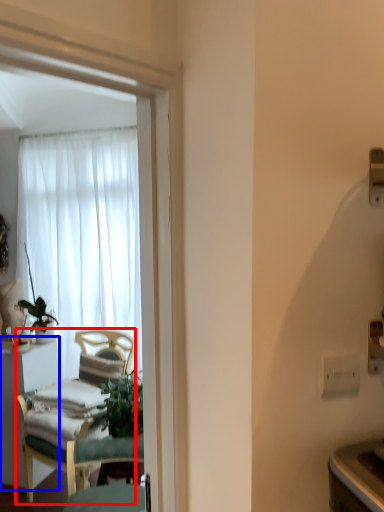
Question: Which object appears farthest to the camera in this image, chair (highlighted by a red box) or desk (highlighted by a blue box)?

Choices:
 (A) chair
 (B) desk

Answer: (B)